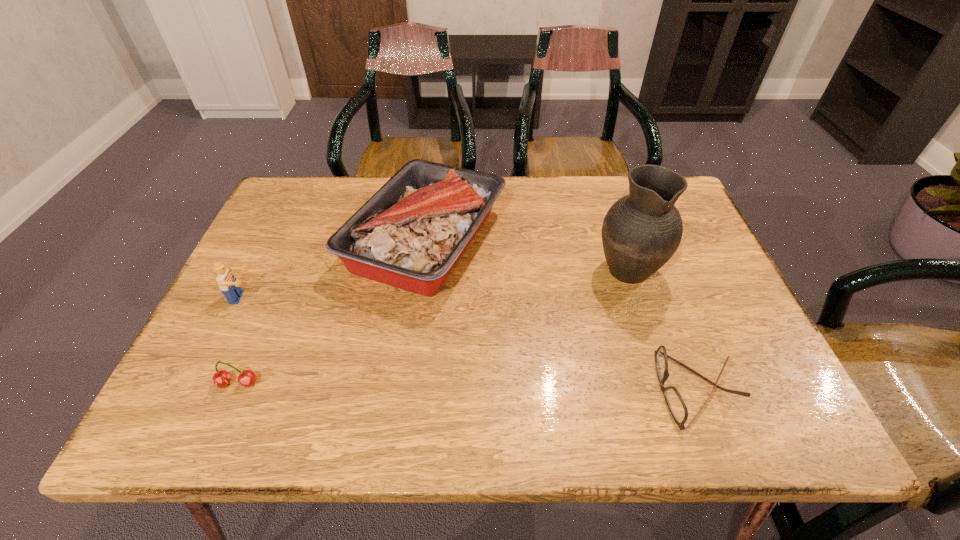
I want to click on pitcher, so click(x=641, y=231).

This screenshot has width=960, height=540. Identify the location of the third object from left to right. (410, 234).

The height and width of the screenshot is (540, 960). I want to click on Lego, so click(229, 286).

The width and height of the screenshot is (960, 540). Identify the location of cherry. (246, 378).

Locate an element on the screen. The width and height of the screenshot is (960, 540). the second object from left to right is located at coordinates (246, 378).

Identify the location of spectacles. (677, 407).

This screenshot has width=960, height=540. Find the location of `free space located on the side of the pitcher with the handle`. free space located on the side of the pitcher with the handle is located at coordinates (602, 190).

Find the location of `vacant region located on the side of the pitcher with the handle`. vacant region located on the side of the pitcher with the handle is located at coordinates (609, 212).

This screenshot has width=960, height=540. I want to click on vacant area situated on the side of the pitcher with the handle, so click(x=598, y=178).

This screenshot has width=960, height=540. Identify the location of vacant space located 0.270m on the front of the tray. (402, 424).